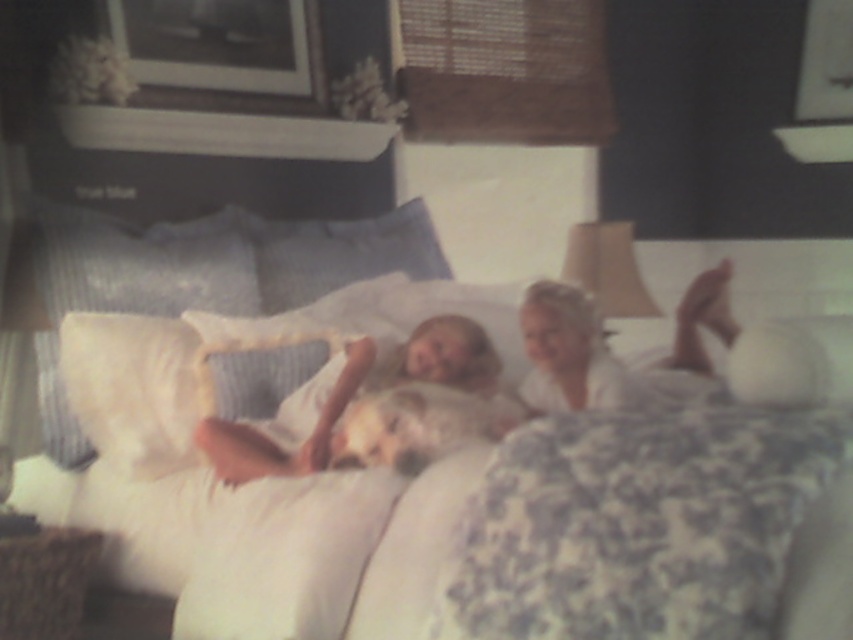
Does point (431, 404) come farther from viewer compared to point (705, 273)?

No, (431, 404) is closer to viewer.

From the picture: Is white soft fabric at center taller than white cotton shirt at upper center?

Indeed, white soft fabric at center has a greater height compared to white cotton shirt at upper center.

Does point (387, 397) come in front of point (546, 285)?

Yes, it is.

This screenshot has width=853, height=640. What are the coordinates of `white soft fabric at center` in the screenshot? It's located at (375, 410).

Does white soft fabric at center come behind white textured pillow at left?

No, it is not.

Does white soft fabric at center lie in front of white textured pillow at left?

That is True.

Image resolution: width=853 pixels, height=640 pixels. What do you see at coordinates (375, 410) in the screenshot?
I see `white soft fabric at center` at bounding box center [375, 410].

Find the location of a particular element. Image resolution: width=853 pixels, height=640 pixels. white soft fabric at center is located at coordinates point(375,410).

Who is more distant from viewer, (x=59, y=317) or (x=550, y=321)?

Point (x=59, y=317)

Which is in front, point (236, 237) or point (709, 296)?

Point (709, 296) is more forward.

Locate an element on the screen. Image resolution: width=853 pixels, height=640 pixels. white textured pillow at left is located at coordinates (132, 285).